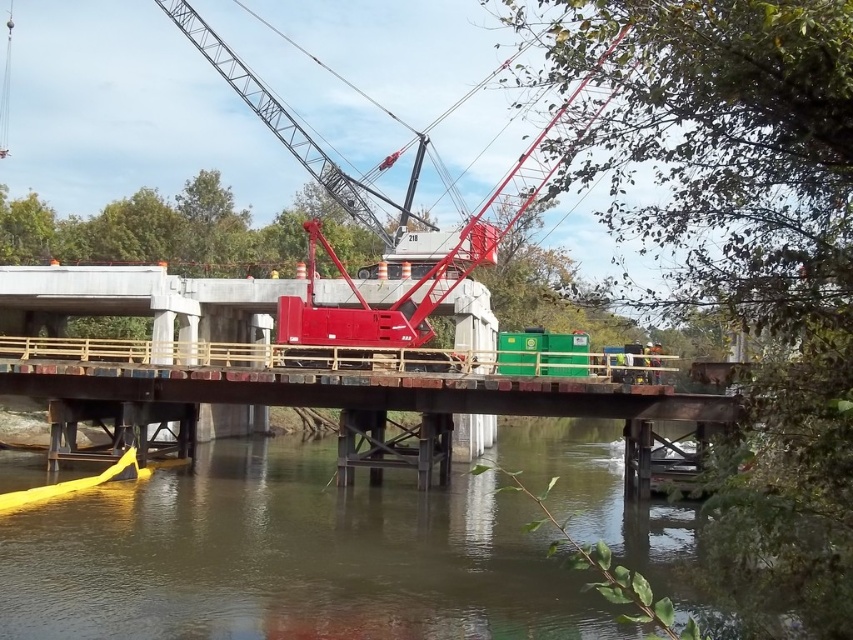
Is metal bridge at lower center further to the viewer compared to metallic red crane at center?

Yes, metal bridge at lower center is further from the viewer.

Based on the photo, does metal bridge at lower center appear on the left side of metallic red crane at center?

No, metal bridge at lower center is not to the left of metallic red crane at center.

Is point (683, 401) in front of point (369, 211)?

Yes.

Where is `metal bridge at lower center`? The height and width of the screenshot is (640, 853). metal bridge at lower center is located at coordinates (381, 403).

Can you confirm if brown murky water at lower center is positioned below metal bridge at lower center?

Yes, brown murky water at lower center is below metal bridge at lower center.

Between brown murky water at lower center and metal bridge at lower center, which one appears on the right side from the viewer's perspective?

metal bridge at lower center is more to the right.

Find the location of `brown murky water at lower center`. brown murky water at lower center is located at coordinates (289, 557).

Is brown murky water at lower center smaller than metallic red crane at center?

Yes, brown murky water at lower center is smaller than metallic red crane at center.

Is brown murky water at lower center below metallic red crane at center?

Correct, brown murky water at lower center is located below metallic red crane at center.

Who is more forward, (154, 630) or (219, 60)?

Point (154, 630) is more forward.

Locate an element on the screen. Image resolution: width=853 pixels, height=640 pixels. brown murky water at lower center is located at coordinates (289, 557).